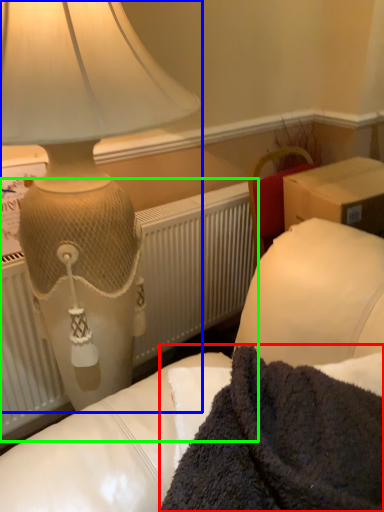
Question: Considering the real-world distances, which object is farthest from blanket (highlighted by a red box)? lamp (highlighted by a blue box) or radiator (highlighted by a green box)?

Choices:
 (A) lamp
 (B) radiator

Answer: (B)